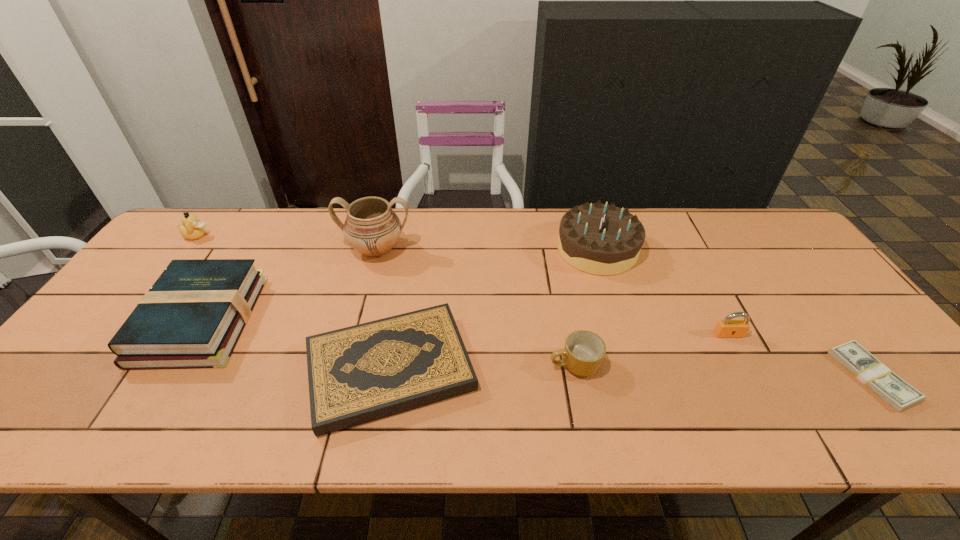
You are a GUI agent. You are given a task and a screenshot of the screen. Output one action in this format:
    pyautogui.click(x=<x>, y=<y>)
    Task: Click on the empty location between the seventh object from left to right and the mug
    The width and height of the screenshot is (960, 540).
    Given the screenshot: What is the action you would take?
    pyautogui.click(x=652, y=349)

Locate an element on the screen. vacant space that is in between the right hardback book and the birthday cake is located at coordinates (494, 309).

Find the location of a particular element. This screenshot has width=960, height=540. unoccupied area between the duckling and the rightmost object is located at coordinates (535, 306).

At what (x,y) coordinates should I click in order to perform the action: click on empty location between the seventh tallest object and the mug. Please return your answer as a coordinate pair (x, y). Looking at the image, I should click on (483, 367).

Identify the location of empty space between the birthday cake and the leftmost object. (397, 242).

You are a GUI agent. You are given a task and a screenshot of the screen. Output one action in this format:
    pyautogui.click(x=<x>, y=<y>)
    Task: Click on the object that can be found as the fifth closest to the seventh object from right to left
    Image resolution: width=960 pixels, height=540 pixels.
    Given the screenshot: What is the action you would take?
    pyautogui.click(x=599, y=239)

At what (x,y) coordinates should I click in order to perform the action: click on object that is the fourth closest to the urn. Please return your answer as a coordinate pair (x, y). The width and height of the screenshot is (960, 540). Looking at the image, I should click on (599, 239).

Identify the location of free point that satisfies the following two spatial constraints: 1. on the back side of the shortest object; 2. on the front-facing side of the birthday cake. (775, 249).

The image size is (960, 540). What are the coordinates of `free location that satisfies the following two spatial constraints: 1. on the back side of the right hardback book; 2. on the face of the duckling` in the screenshot? It's located at (415, 236).

At what (x,y) coordinates should I click in order to perform the action: click on free space that satisfies the following two spatial constraints: 1. on the front-facing side of the shorter hardback book; 2. on the left side of the urn. Please return your answer as a coordinate pair (x, y). This screenshot has height=540, width=960. Looking at the image, I should click on (345, 369).